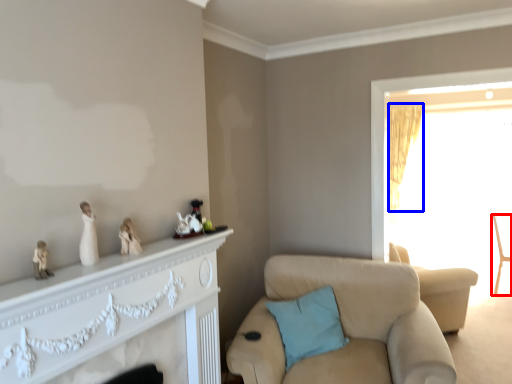
Question: Among these objects, which one is farthest to the camera, chair (highlighted by a red box) or curtain (highlighted by a blue box)?

Choices:
 (A) chair
 (B) curtain

Answer: (B)